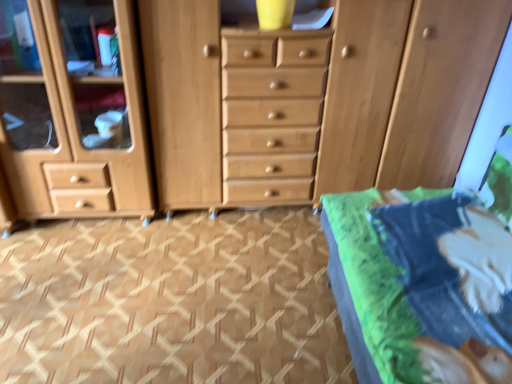
The image size is (512, 384). What do you see at coordinates (238, 103) in the screenshot?
I see `light brown wood chest of drawers at center` at bounding box center [238, 103].

Describe the element at coordinates (426, 278) in the screenshot. This screenshot has width=512, height=384. I see `green fabric bed at lower right` at that location.

Identify the location of light brown wood chest of drawers at center. The width and height of the screenshot is (512, 384). (238, 103).

I want to click on bed on the right of brown textured carpet at center, so click(426, 278).

Between green fabric bed at lower right and brown textured carpet at center, which one is positioned behind?

brown textured carpet at center is further away from the camera.

Considering the sizes of objects green fabric bed at lower right and brown textured carpet at center in the image provided, who is shorter, green fabric bed at lower right or brown textured carpet at center?

brown textured carpet at center is shorter.

Is green fabric bed at lower right facing towards brown textured carpet at center?

Yes, green fabric bed at lower right is oriented towards brown textured carpet at center.

This screenshot has height=384, width=512. What are the coordinates of `tile that is on the left side of light brown wood chest of drawers at center` in the screenshot? It's located at (170, 301).

Considering the relative sizes of brown textured carpet at center and light brown wood chest of drawers at center in the image provided, is brown textured carpet at center thinner than light brown wood chest of drawers at center?

No, brown textured carpet at center is not thinner than light brown wood chest of drawers at center.

From the picture: Which is nearer, (303, 274) or (415, 52)?

Point (303, 274) is farther from the camera than point (415, 52).

Could you tell me if brown textured carpet at center is turned towards green fabric bed at lower right?

No, brown textured carpet at center is not turned towards green fabric bed at lower right.

Is brown textured carpet at center positioned in front of green fabric bed at lower right?

No, it is behind green fabric bed at lower right.

From the image's perspective, which is below, brown textured carpet at center or green fabric bed at lower right?

brown textured carpet at center, from the image's perspective.

Locate an element on the screen. bed located in front of the brown textured carpet at center is located at coordinates (426, 278).

Between light brown wood chest of drawers at center and brown textured carpet at center, which one has less height?

With less height is brown textured carpet at center.

Considering their positions, is light brown wood chest of drawers at center located in front of or behind brown textured carpet at center?

Visually, light brown wood chest of drawers at center is located behind brown textured carpet at center.

From a real-world perspective, is light brown wood chest of drawers at center located higher than brown textured carpet at center?

Indeed, from a real-world perspective, light brown wood chest of drawers at center stands above brown textured carpet at center.

Is light brown wood chest of drawers at center far away from brown textured carpet at center?

No.

From the picture: Which is correct: green fabric bed at lower right is inside light brown wood chest of drawers at center, or outside of it?

green fabric bed at lower right cannot be found inside light brown wood chest of drawers at center.

The image size is (512, 384). What are the coordinates of `bed located underneath the light brown wood chest of drawers at center (from a real-world perspective)` in the screenshot? It's located at (426, 278).

From the image's perspective, which one is positioned higher, green fabric bed at lower right or light brown wood chest of drawers at center?

light brown wood chest of drawers at center.

The image size is (512, 384). In order to click on bed beneath the light brown wood chest of drawers at center (from a real-world perspective) in this screenshot , I will do `click(426, 278)`.

In terms of width, does light brown wood chest of drawers at center look wider or thinner when compared to green fabric bed at lower right?

light brown wood chest of drawers at center is thinner than green fabric bed at lower right.

From a real-world perspective, is light brown wood chest of drawers at center positioned above or below green fabric bed at lower right?

Clearly, from a real-world perspective, light brown wood chest of drawers at center is above green fabric bed at lower right.

Considering the sizes of objects light brown wood chest of drawers at center and green fabric bed at lower right in the image provided, who is taller, light brown wood chest of drawers at center or green fabric bed at lower right?

light brown wood chest of drawers at center is taller.

Locate an element on the screen. tile located behind the green fabric bed at lower right is located at coordinates (170, 301).

You are a GUI agent. You are given a task and a screenshot of the screen. Output one action in this format:
    pyautogui.click(x=<x>, y=<y>)
    Task: Click on the tile on the left of light brown wood chest of drawers at center
    The width and height of the screenshot is (512, 384).
    Given the screenshot: What is the action you would take?
    point(170,301)

Which object lies nearer to the anchor point brown textured carpet at center, green fabric bed at lower right or light brown wood chest of drawers at center?

Among the two, light brown wood chest of drawers at center is located nearer to brown textured carpet at center.

Which object lies nearer to the anchor point light brown wood chest of drawers at center, brown textured carpet at center or green fabric bed at lower right?

brown textured carpet at center is closer to light brown wood chest of drawers at center.

Which object lies nearer to the anchor point green fabric bed at lower right, brown textured carpet at center or light brown wood chest of drawers at center?

The object closer to green fabric bed at lower right is brown textured carpet at center.

Which object lies further to the anchor point green fabric bed at lower right, light brown wood chest of drawers at center or brown textured carpet at center?

light brown wood chest of drawers at center lies further to green fabric bed at lower right than the other object.

From the image, which object appears to be farther from light brown wood chest of drawers at center, green fabric bed at lower right or brown textured carpet at center?

green fabric bed at lower right.

Looking at the image, which one is located closer to brown textured carpet at center, light brown wood chest of drawers at center or green fabric bed at lower right?

Among the two, light brown wood chest of drawers at center is located nearer to brown textured carpet at center.

In order to click on chest of drawers between brown textured carpet at center and green fabric bed at lower right in this screenshot , I will do `click(238, 103)`.